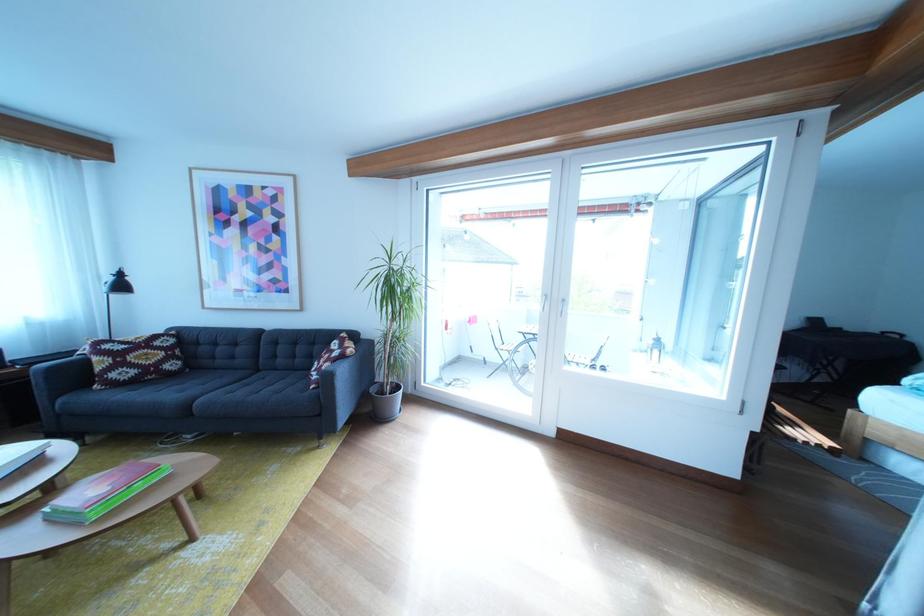
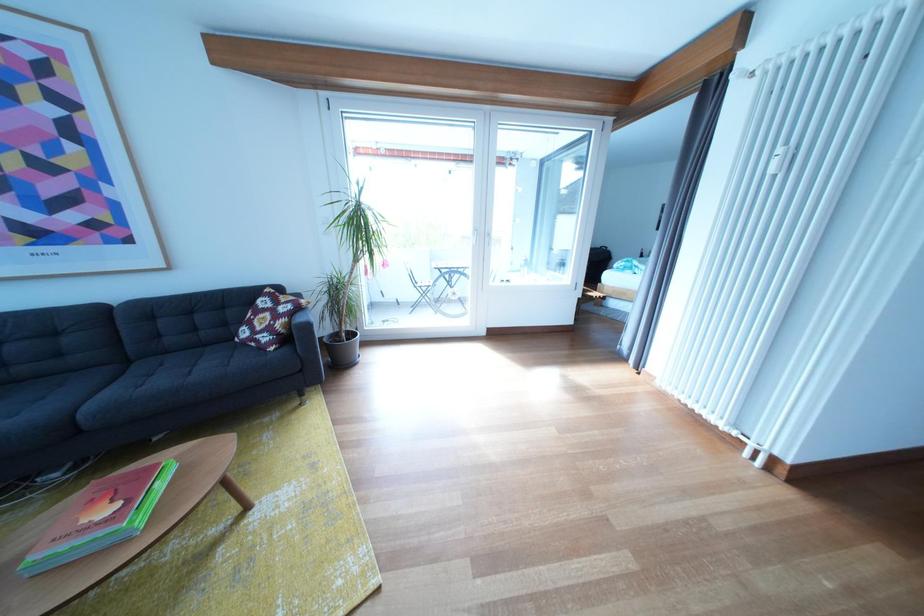
Question: The first image is from the beginning of the video and the second image is from the end. How did the camera likely rotate when shooting the video?

Choices:
 (A) Left
 (B) Right
 (C) Up
 (D) Down

Answer: (B)